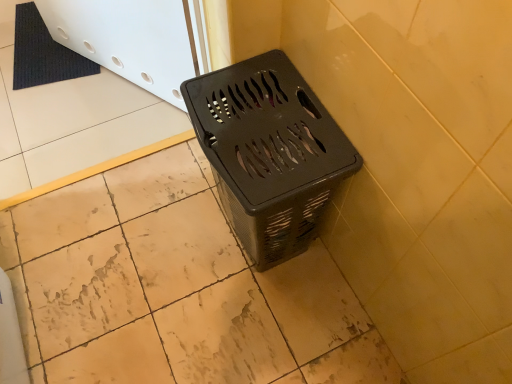
The width and height of the screenshot is (512, 384). I want to click on empty space that is ontop of black plastic basket at center, so click(x=266, y=118).